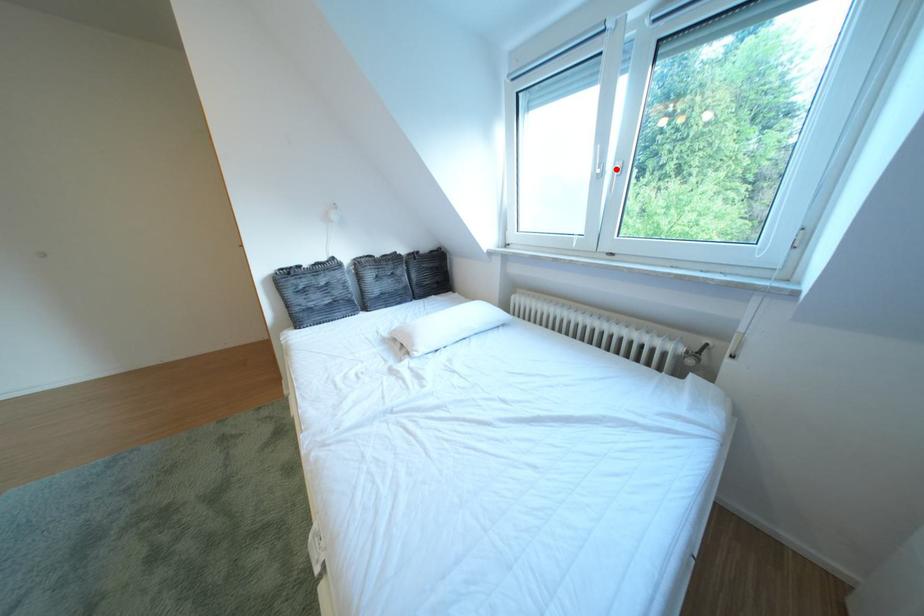
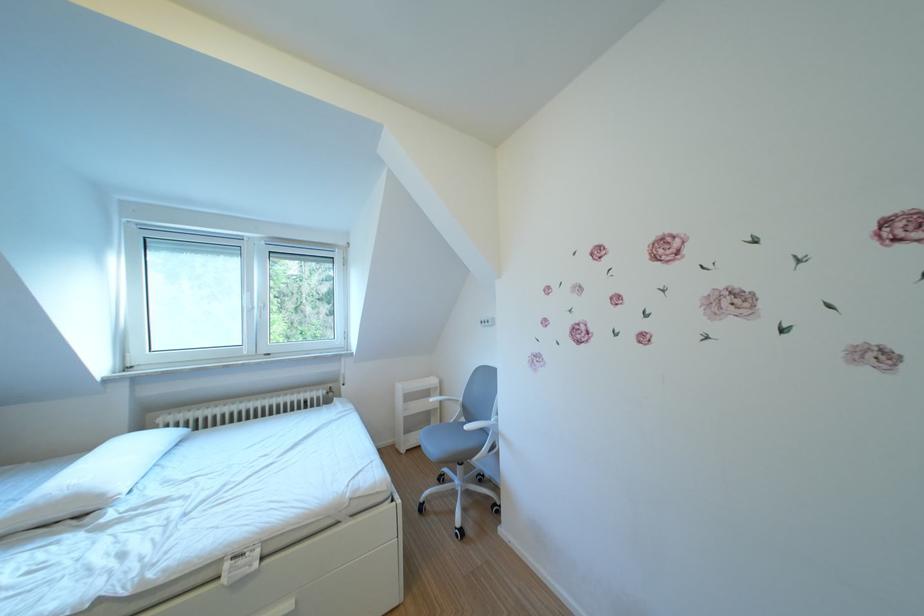
Question: I am providing you with two images of the same scene from different viewpoints. A red point is marked on the first image. At the location where the point appears in image 1, is it still visible in image 2?

Choices:
 (A) Yes
 (B) No

Answer: (A)